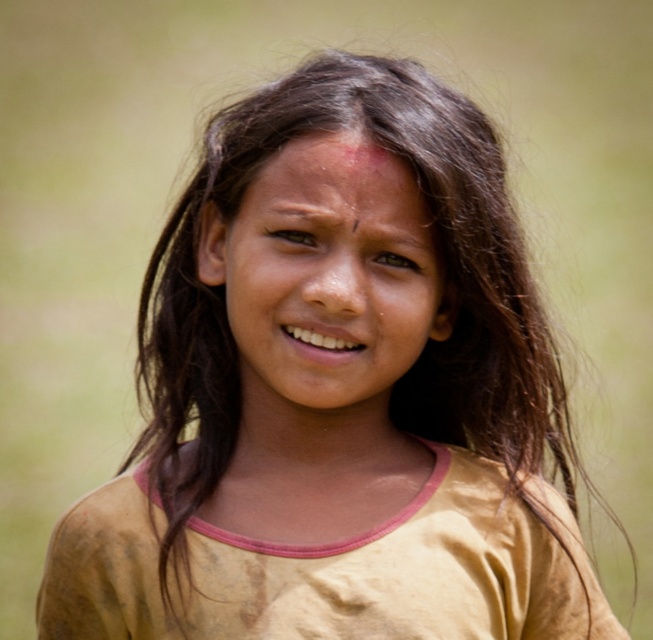
Can you confirm if smooth skin face at center is smaller than smooth skin forehead at center?

No.

Who is more distant from viewer, (310,252) or (279,218)?

Positioned behind is point (310,252).

The width and height of the screenshot is (653, 640). In order to click on smooth skin face at center in this screenshot , I will do `click(326, 278)`.